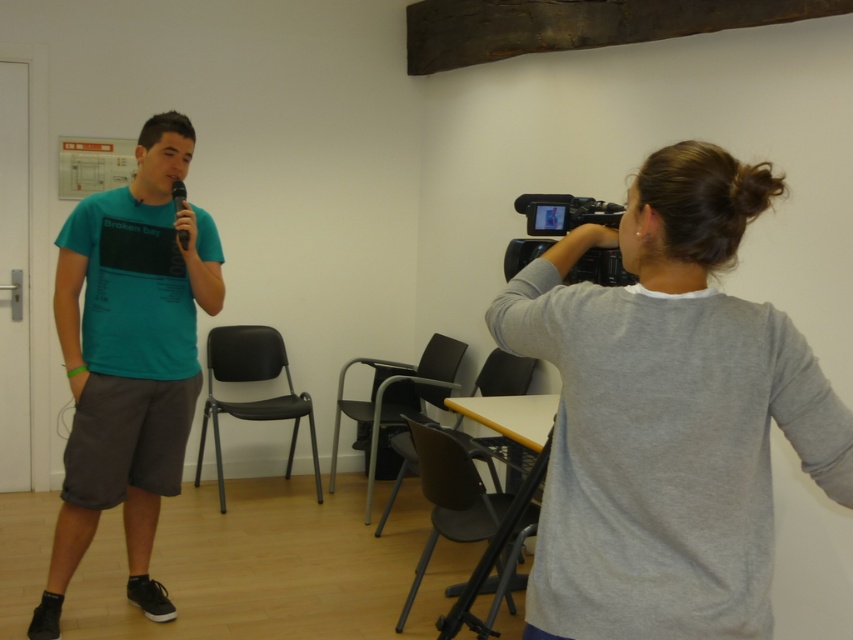
Is point (183, 316) farther from viewer compared to point (187, 240)?

Yes, point (183, 316) is farther from viewer.

Between teal fabric shirt at left and black matte microphone at left, which one is positioned higher?

black matte microphone at left

Who is more forward, (57, 282) or (178, 237)?

Point (178, 237) is in front.

Find the location of `teal fabric shirt at left`. teal fabric shirt at left is located at coordinates (129, 358).

Between gray matte shirt at upper right and black plastic video camera at center, which one appears on the right side from the viewer's perspective?

gray matte shirt at upper right

Is gray matte shirt at upper right below black plastic video camera at center?

Yes, gray matte shirt at upper right is below black plastic video camera at center.

The image size is (853, 640). Describe the element at coordinates (666, 413) in the screenshot. I see `gray matte shirt at upper right` at that location.

At what (x,y) coordinates should I click in order to perform the action: click on gray matte shirt at upper right. Please return your answer as a coordinate pair (x, y). Image resolution: width=853 pixels, height=640 pixels. Looking at the image, I should click on (666, 413).

Which of these two, black plastic video camera at center or black plastic tripod at lower center, stands shorter?

black plastic video camera at center

Can you confirm if black plastic video camera at center is positioned below black plastic tripod at lower center?

No, black plastic video camera at center is not below black plastic tripod at lower center.

This screenshot has width=853, height=640. What are the coordinates of `black plastic video camera at center` in the screenshot? It's located at [x=564, y=212].

Locate an element on the screen. black plastic video camera at center is located at coordinates (564, 212).